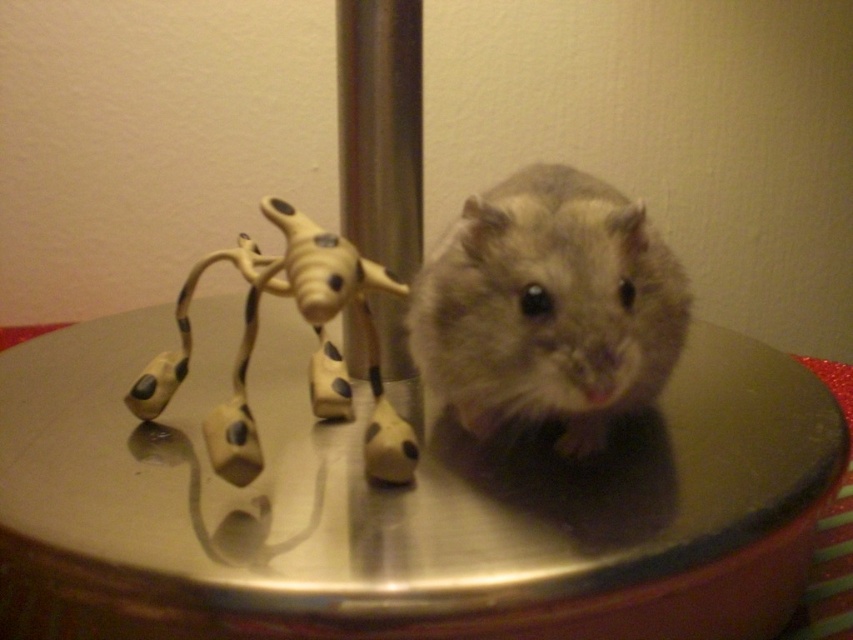
Between point (438, 364) and point (231, 400), which one is positioned in front?

Positioned in front is point (231, 400).

Does point (537, 225) come farther from viewer compared to point (372, 346)?

No, it is in front of (372, 346).

What do you see at coordinates (548, 307) in the screenshot? This screenshot has height=640, width=853. I see `fuzzy gray mouse at center` at bounding box center [548, 307].

Locate an element on the screen. fuzzy gray mouse at center is located at coordinates (548, 307).